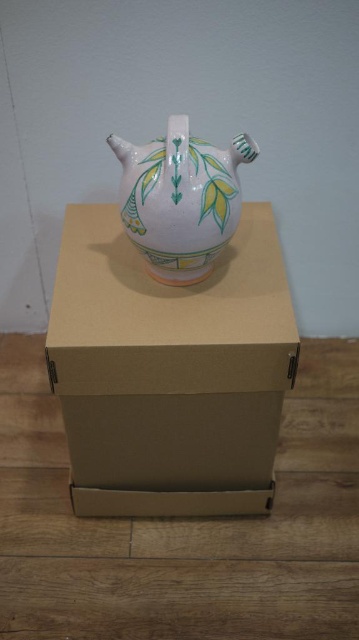
Question: Considering the relative positions of brown cardboard box at center and porcelain teapot at center in the image provided, where is brown cardboard box at center located with respect to porcelain teapot at center?

Choices:
 (A) left
 (B) right

Answer: (A)

Question: From the image, what is the correct spatial relationship of brown cardboard box at center in relation to porcelain teapot at center?

Choices:
 (A) left
 (B) right

Answer: (A)

Question: Which of the following is the farthest from the observer?

Choices:
 (A) brown cardboard box at center
 (B) porcelain teapot at center

Answer: (A)

Question: Is brown cardboard box at center bigger than porcelain teapot at center?

Choices:
 (A) yes
 (B) no

Answer: (A)

Question: Which of the following is the closest to the observer?

Choices:
 (A) brown cardboard box at center
 (B) porcelain teapot at center

Answer: (B)